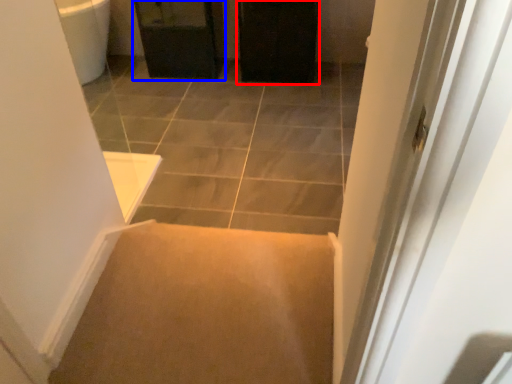
Question: Which point is closer to the camera, screen door (highlighted by a red box) or cabinetry (highlighted by a blue box)?

Choices:
 (A) screen door
 (B) cabinetry

Answer: (A)